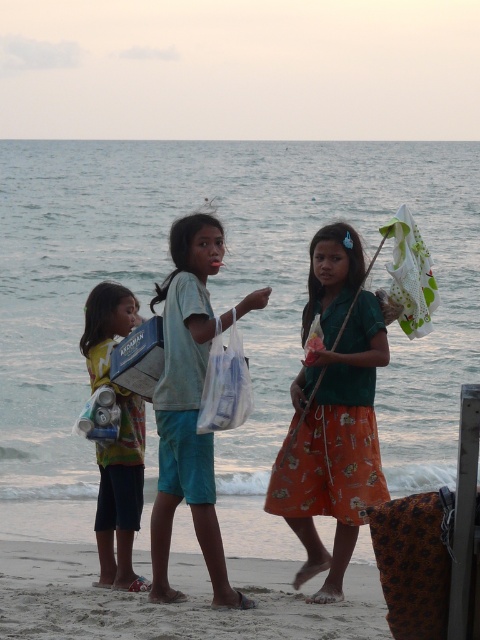
Is sandy beach at lower center below light blue shorts at center?

Indeed, sandy beach at lower center is positioned under light blue shorts at center.

Which of these two, sandy beach at lower center or light blue shorts at center, stands taller?

Standing taller between the two is light blue shorts at center.

Is point (19, 560) closer to viewer compared to point (192, 262)?

That is False.

The image size is (480, 640). What are the coordinates of `sandy beach at lower center` in the screenshot? It's located at click(175, 604).

Does green cotton shirt at center have a lesser width compared to light blue shorts at center?

No.

Who is more forward, (348, 337) or (202, 332)?

Point (202, 332) is in front.

Which is in front, point (345, 467) or point (196, 438)?

Positioned in front is point (196, 438).

Image resolution: width=480 pixels, height=640 pixels. What are the coordinates of `green cotton shirt at center` in the screenshot? It's located at 333,413.

Can you confirm if green cotton shirt at center is taller than multicolored fabric bag at left?

Indeed, green cotton shirt at center has a greater height compared to multicolored fabric bag at left.

Describe the element at coordinates (333, 413) in the screenshot. I see `green cotton shirt at center` at that location.

Is point (331, 310) in front of point (113, 449)?

Yes, it is in front of point (113, 449).

This screenshot has height=640, width=480. What are the coordinates of `green cotton shirt at center` in the screenshot? It's located at (333, 413).